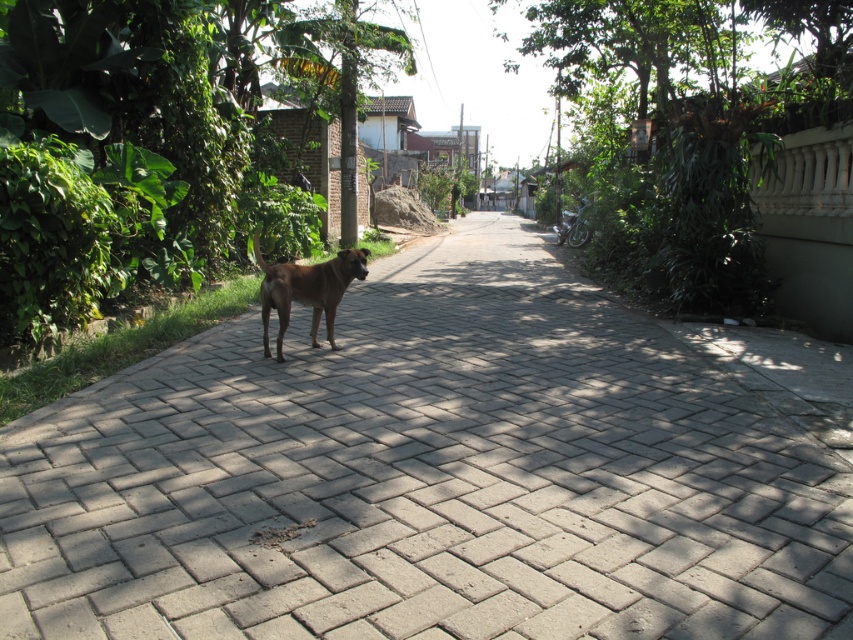
Find the location of a particular element. gray brick pavement at center is located at coordinates (442, 472).

Is gray brick pavement at center above brown furry dog at center?

No.

Which is behind, point (358, 547) or point (279, 308)?

The point (279, 308) is behind.

What are the coordinates of `gray brick pavement at center` in the screenshot? It's located at 442,472.